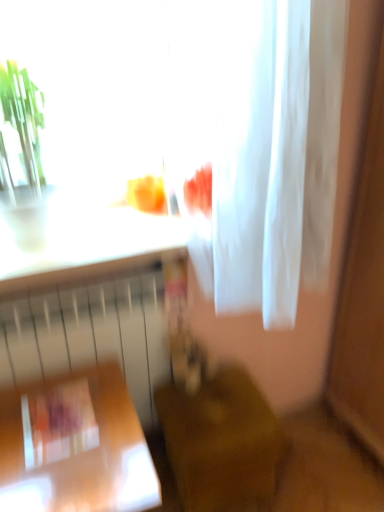
I want to click on free region under matte plastic book at lower left (from a real-world perspective), so click(x=56, y=415).